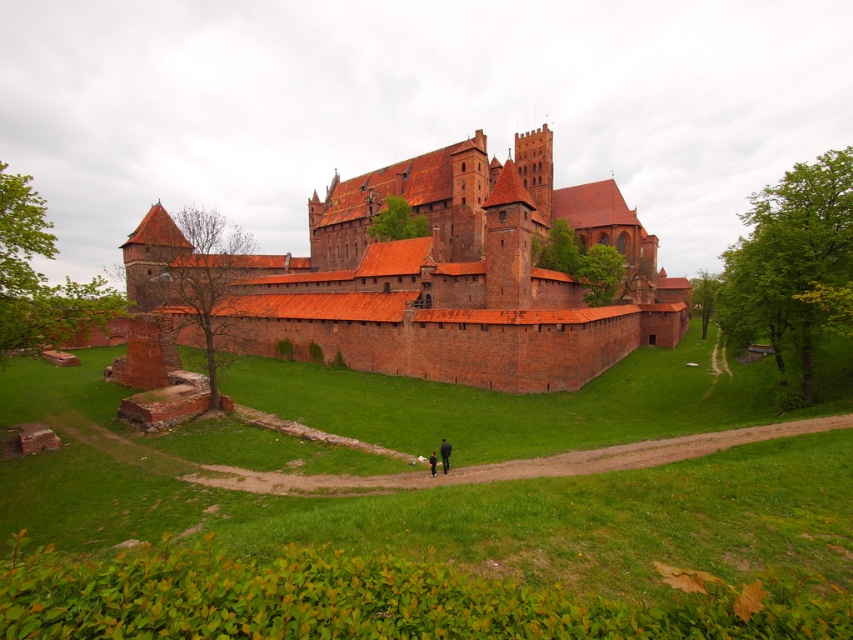
Question: Which object appears closest to the camera in this image?

Choices:
 (A) dark blue jeans at lower center
 (B) black fabric person at lower center
 (C) brick wall at center

Answer: (B)

Question: Is the position of brick wall at center less distant than that of black fabric person at lower center?

Choices:
 (A) yes
 (B) no

Answer: (B)

Question: Is brick wall at center below black fabric person at lower center?

Choices:
 (A) no
 (B) yes

Answer: (A)

Question: Which object appears farthest from the camera in this image?

Choices:
 (A) dark blue jeans at lower center
 (B) brick wall at center
 (C) black fabric person at lower center

Answer: (B)

Question: Considering the relative positions of brick wall at center and dark blue jeans at lower center in the image provided, where is brick wall at center located with respect to dark blue jeans at lower center?

Choices:
 (A) below
 (B) above

Answer: (B)

Question: Which point is closer to the camera?

Choices:
 (A) brick wall at center
 (B) dark blue jeans at lower center

Answer: (B)